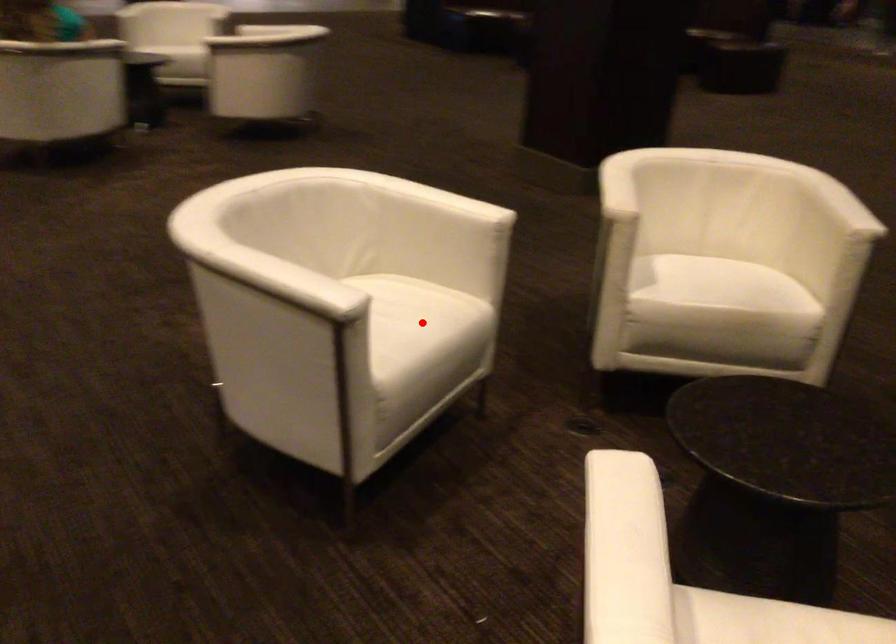
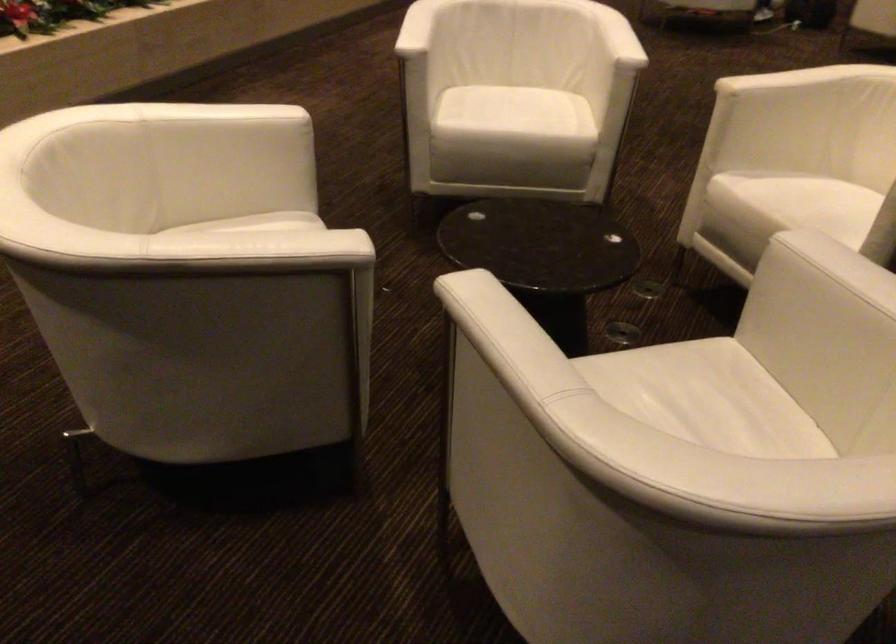
Question: I am providing you with two images of the same scene from different viewpoints. A red point is marked on the first image. At the location where the point appears in image 1, is it still visible in image 2?

Choices:
 (A) Yes
 (B) No

Answer: (A)